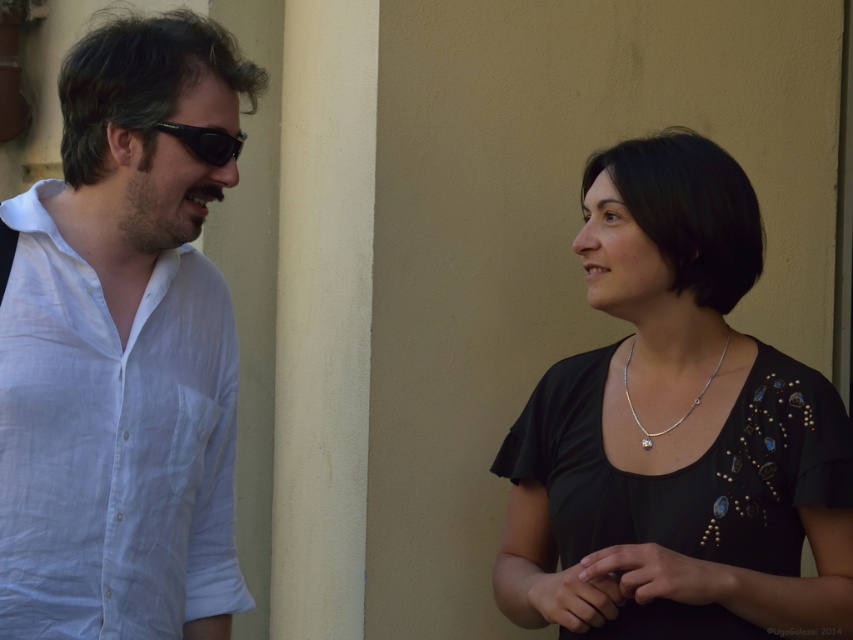
From the picture: You are a fashion designer trying to place both the black satin dress at right and the black plastic sunglasses at left on a narrow mannequin stand that can only accommodate one item at a time. Based on their sizes, which item should you choose to fit first?

The black plastic sunglasses at left are narrower than the black satin dress at right, so you should place the black plastic sunglasses at left first to ensure they fit on the narrow mannequin stand.

You are standing in front of the scene and want to know how far the point at coordinates (224, 156) is from you. Can you determine the distance?

The distance of point (224, 156) from camera is 7.60 feet.